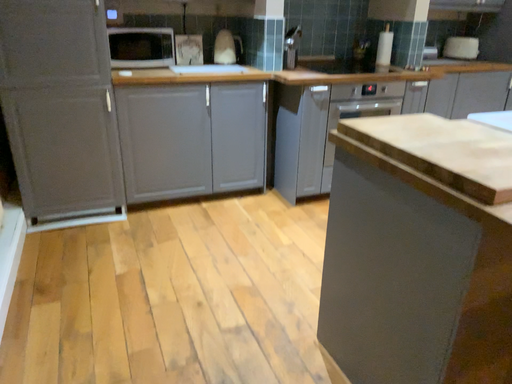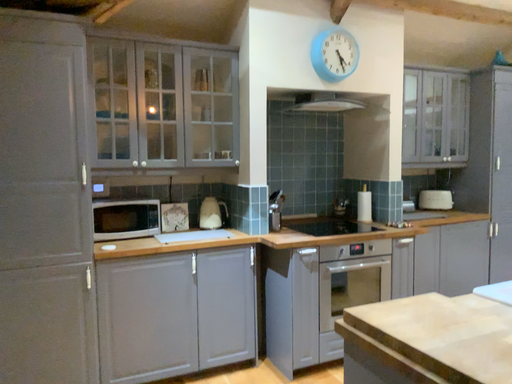
Question: Which way did the camera rotate in the video?

Choices:
 (A) rotated downward
 (B) rotated upward

Answer: (B)